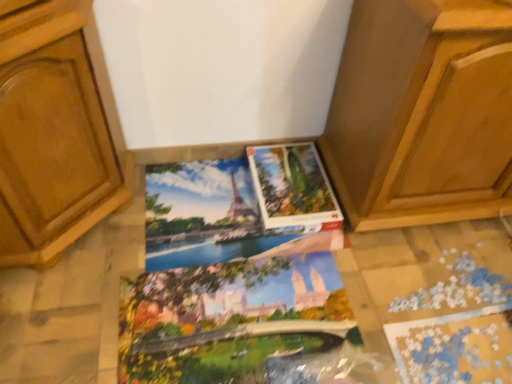
The width and height of the screenshot is (512, 384). I want to click on vacant space that is in between wooden cabinet at center and matte paper coloring book at center, placed as the first coloring book when sorted from top to bottom, so click(325, 247).